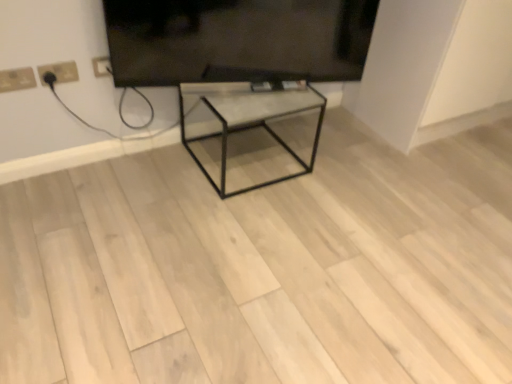
Question: Can you confirm if white plastic socket at upper left, the first electric outlet in the right-to-left sequence, is wider than white plastic electric outlet at upper left, which appears as the second electric outlet when viewed from the right?

Choices:
 (A) no
 (B) yes

Answer: (B)

Question: Considering the relative sizes of white plastic socket at upper left, positioned as the second electric outlet in left-to-right order, and white plastic electric outlet at upper left, which appears as the second electric outlet when viewed from the right, in the image provided, is white plastic socket at upper left, positioned as the second electric outlet in left-to-right order, thinner than white plastic electric outlet at upper left, which appears as the second electric outlet when viewed from the right,?

Choices:
 (A) no
 (B) yes

Answer: (A)

Question: Is white plastic socket at upper left, positioned as the second electric outlet in left-to-right order, shorter than white plastic electric outlet at upper left, which appears as the 1th electric outlet when viewed from the left?

Choices:
 (A) yes
 (B) no

Answer: (B)

Question: Is white plastic socket at upper left, the first electric outlet in the right-to-left sequence, oriented away from white plastic electric outlet at upper left, which appears as the second electric outlet when viewed from the right?

Choices:
 (A) no
 (B) yes

Answer: (A)

Question: From the image's perspective, is white plastic socket at upper left, the first electric outlet in the right-to-left sequence, on top of white plastic electric outlet at upper left, which appears as the second electric outlet when viewed from the right?

Choices:
 (A) yes
 (B) no

Answer: (A)

Question: From a real-world perspective, relative to black glossy tv at upper center, is metallic glass table at center vertically above or below?

Choices:
 (A) below
 (B) above

Answer: (A)

Question: Does point tap(245, 92) appear closer or farther from the camera than point tap(243, 66)?

Choices:
 (A) closer
 (B) farther

Answer: (B)

Question: Is metallic glass table at center taller or shorter than black glossy tv at upper center?

Choices:
 (A) short
 (B) tall

Answer: (B)

Question: From the image's perspective, is metallic glass table at center positioned above or below black glossy tv at upper center?

Choices:
 (A) below
 (B) above

Answer: (A)

Question: Is point (245, 100) closer or farther from the camera than point (65, 82)?

Choices:
 (A) closer
 (B) farther

Answer: (B)

Question: In terms of size, does metallic glass table at center appear bigger or smaller than white plastic socket at upper left, positioned as the second electric outlet in left-to-right order?

Choices:
 (A) big
 (B) small

Answer: (A)

Question: Choose the correct answer: Is metallic glass table at center inside white plastic socket at upper left, the first electric outlet in the right-to-left sequence, or outside it?

Choices:
 (A) outside
 (B) inside

Answer: (A)

Question: Is metallic glass table at center to the left or to the right of white plastic socket at upper left, the first electric outlet in the right-to-left sequence, in the image?

Choices:
 (A) left
 (B) right

Answer: (B)

Question: From their relative heights in the image, would you say white plastic electric outlet at upper left, which appears as the second electric outlet when viewed from the right, is taller or shorter than metallic glass table at center?

Choices:
 (A) short
 (B) tall

Answer: (A)

Question: Is point (24, 79) closer or farther from the camera than point (242, 122)?

Choices:
 (A) farther
 (B) closer

Answer: (B)